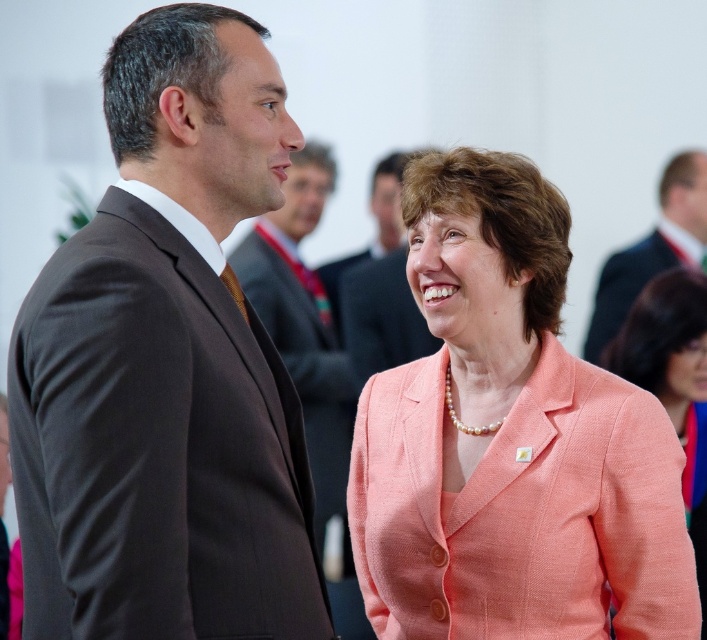
Looking at this image, is dark brown suit at left above peach fabric jacket at center?

Correct, dark brown suit at left is located above peach fabric jacket at center.

Between dark brown suit at left and peach fabric jacket at center, which one has more height?

Standing taller between the two is peach fabric jacket at center.

Describe the element at coordinates (165, 365) in the screenshot. The height and width of the screenshot is (640, 707). I see `dark brown suit at left` at that location.

At what (x,y) coordinates should I click in order to perform the action: click on dark brown suit at left. Please return your answer as a coordinate pair (x, y). The width and height of the screenshot is (707, 640). Looking at the image, I should click on (165, 365).

Which of these two, peach fabric jacket at center or dark suit at upper right, stands shorter?

With less height is dark suit at upper right.

Is point (638, 337) closer to camera compared to point (674, 205)?

Yes, point (638, 337) is in front of point (674, 205).

Where is `peach fabric jacket at center`? This screenshot has width=707, height=640. peach fabric jacket at center is located at coordinates (672, 381).

In the scene shown: Can you confirm if peach fabric jacket at center is positioned to the right of dark brown suit at center?

Yes, peach fabric jacket at center is to the right of dark brown suit at center.

Does peach fabric jacket at center have a lesser height compared to dark brown suit at center?

No.

Which is behind, point (691, 433) or point (380, 163)?

The point (380, 163) is more distant.

Find the location of a particular element. The image size is (707, 640). peach fabric jacket at center is located at coordinates pos(672,381).